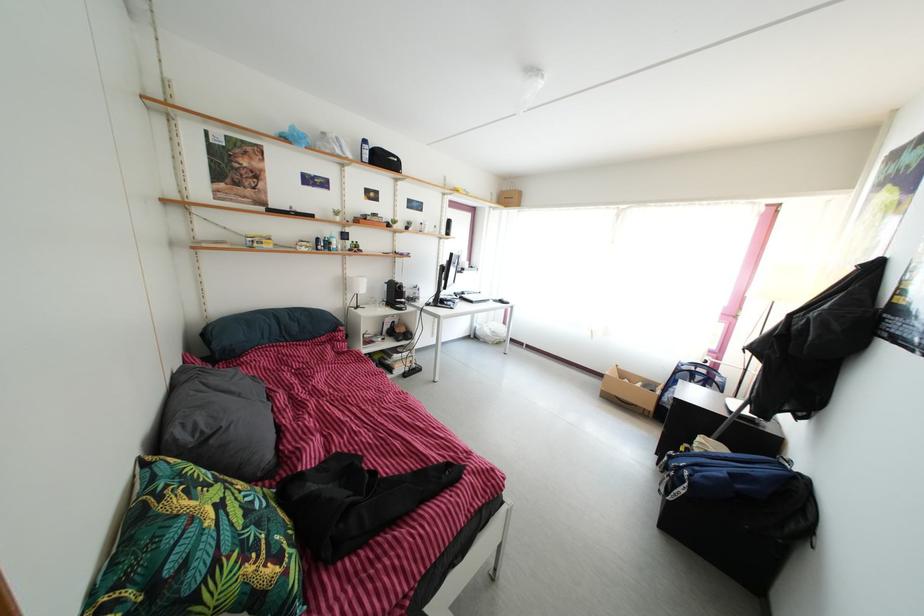
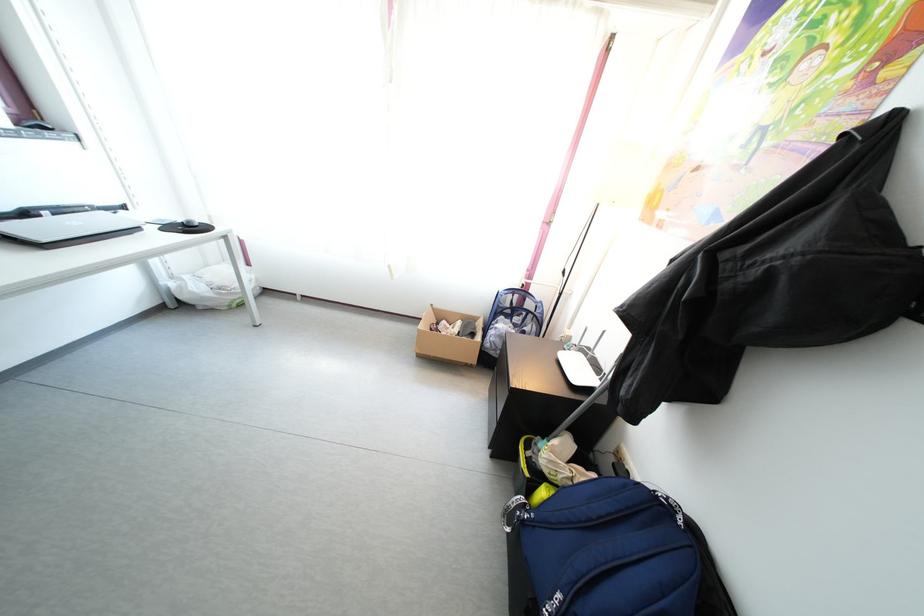
Where in the second image is the point corresponding to [492,342] from the first image?

(210, 306)